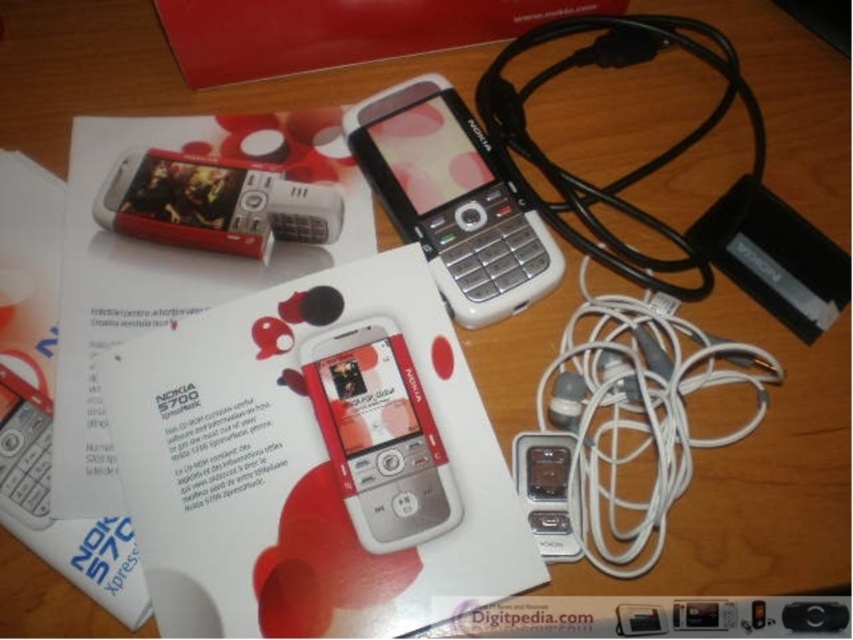
You are organizing a tech exhibit and need to place the white matte nokia phone at center and the satin silver ipod at lower center on a display shelf. The shelf has a width of 25 centimeters. Will both items fit side by side without overlapping?

The white matte nokia phone at center is 23.52 centimeters from the satin silver ipod at lower center. Since the total distance between them is less than the shelf width of 25 centimeters, they can fit side by side without overlapping.

You are a photographer standing at the camera position. You want to take a closeup photo of the silver metallic smartphone at center. Can you reach it without moving your feet?

The silver metallic smartphone at center is 26.38 inches away from the camera. Since the average human arm length is about 25 inches, you would need to extend your arm fully to reach it, but it might be slightly out of reach without moving your feet.